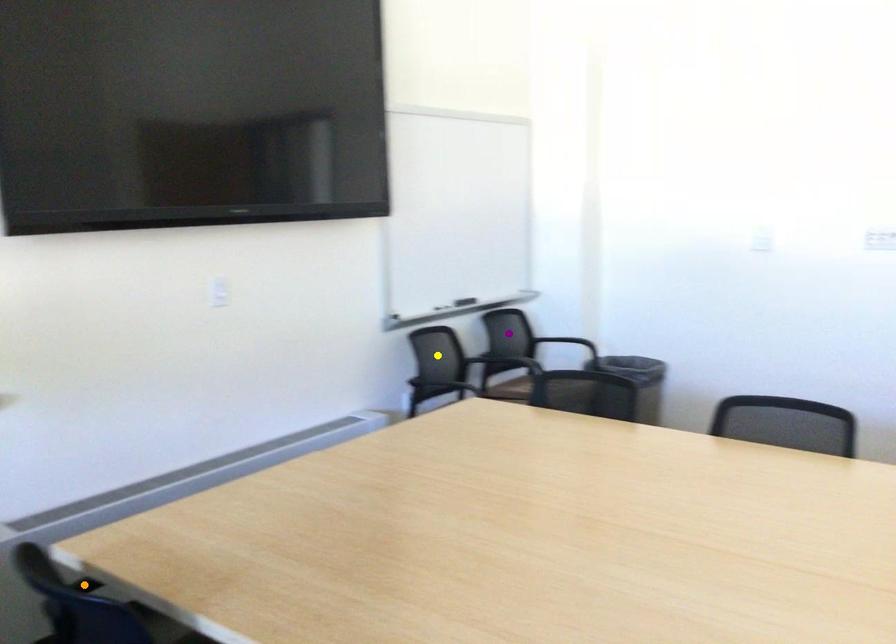
Order these from farthest to nearest:
- purple point
- yellow point
- orange point

purple point, yellow point, orange point